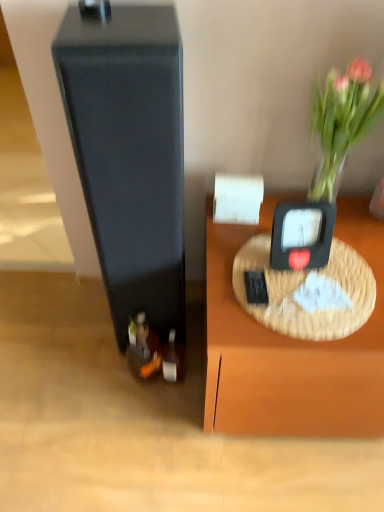
Question: Considering the positions of shiny silver wine bottle at lower center, marked as the 1th wine bottle in a right-to-left arrangement, and matte black speaker at left in the image, is shiny silver wine bottle at lower center, marked as the 1th wine bottle in a right-to-left arrangement, taller or shorter than matte black speaker at left?

Choices:
 (A) tall
 (B) short

Answer: (B)

Question: From a real-world perspective, is shiny silver wine bottle at lower center, marked as the 1th wine bottle in a right-to-left arrangement, above or below matte black speaker at left?

Choices:
 (A) above
 (B) below

Answer: (B)

Question: Estimate the real-world distances between objects in this image. Which object is closer to the shiny silver wine bottle at lower center, marked as the 1th wine bottle in a right-to-left arrangement?

Choices:
 (A) matte black speaker at left
 (B) translucent glass vase at upper right
 (C) black plastic weight scale at upper right
 (D) shiny dark glass wine bottle at lower left, which is the 2th wine bottle from right to left

Answer: (D)

Question: Estimate the real-world distances between objects in this image. Which object is farther from the shiny dark glass wine bottle at lower left, the 1th wine bottle viewed from the left?

Choices:
 (A) black plastic weight scale at upper right
 (B) translucent glass vase at upper right
 (C) matte black speaker at left
 (D) shiny silver wine bottle at lower center, which is the second wine bottle in left-to-right order

Answer: (B)